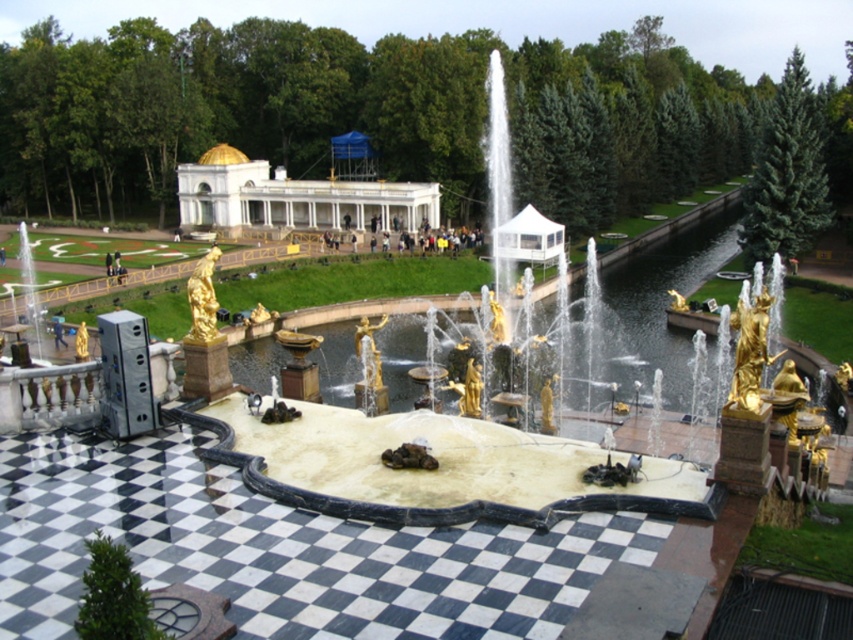
Does gold statue fountain at center have a lesser width compared to white marble palace at center?

In fact, gold statue fountain at center might be wider than white marble palace at center.

Between gold statue fountain at center and white marble palace at center, which one appears on the right side from the viewer's perspective?

gold statue fountain at center

Locate an element on the screen. gold statue fountain at center is located at coordinates (456, 468).